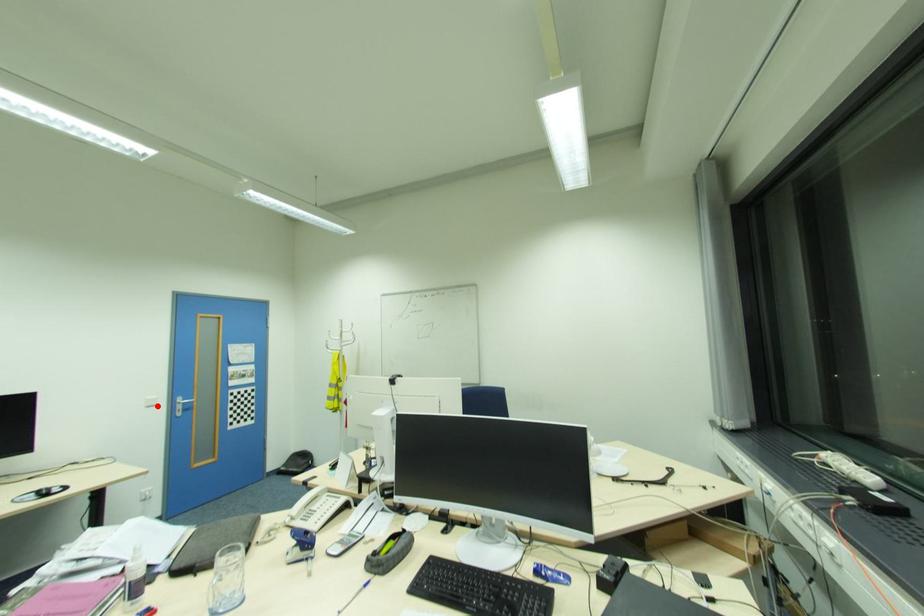
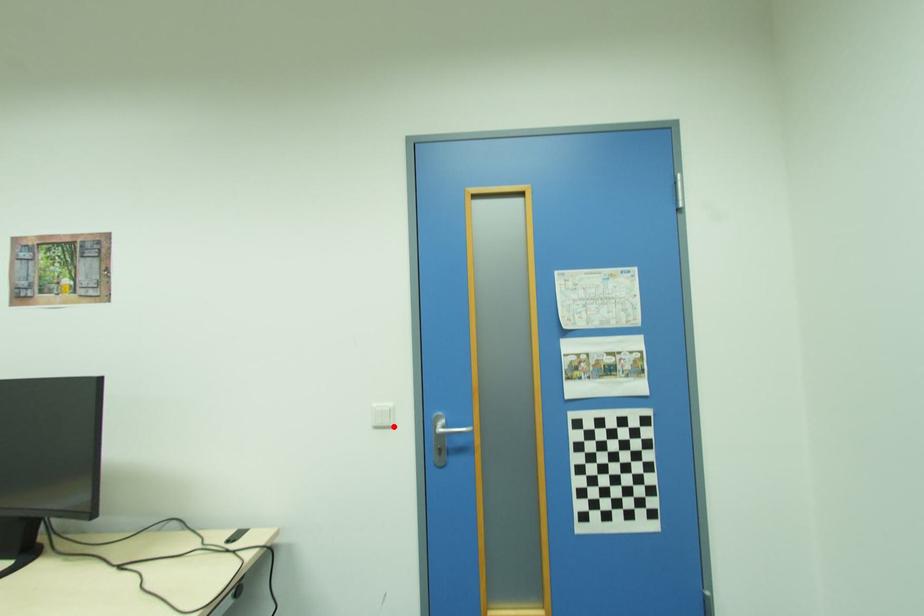
I am providing you with two images of the same scene from different viewpoints. A red point is marked on the first image and another point is marked on the second image. Is the marked point in image1 the same physical position as the marked point in image2?

Yes